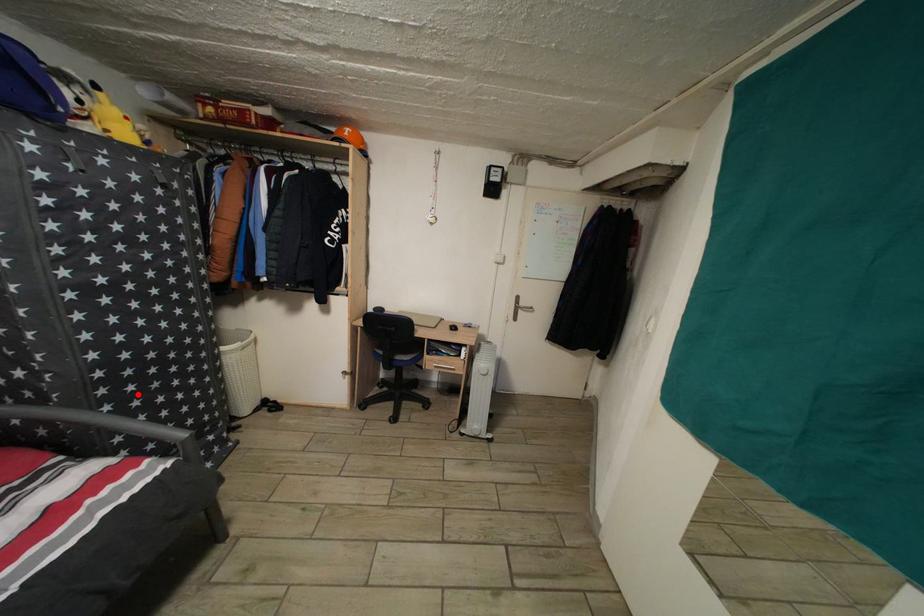
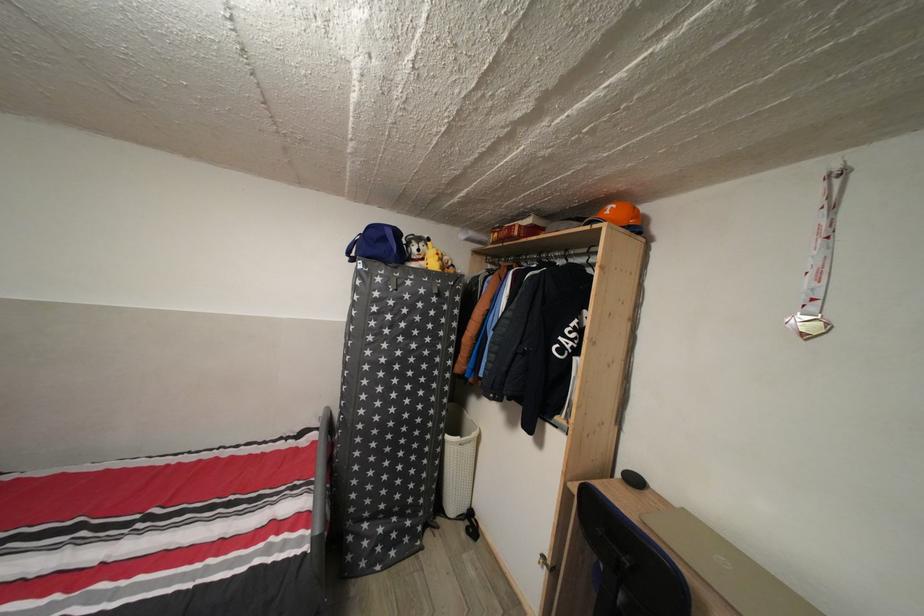
Find the pixel in the second image that matches the highlighted location in the first image.

(380, 451)